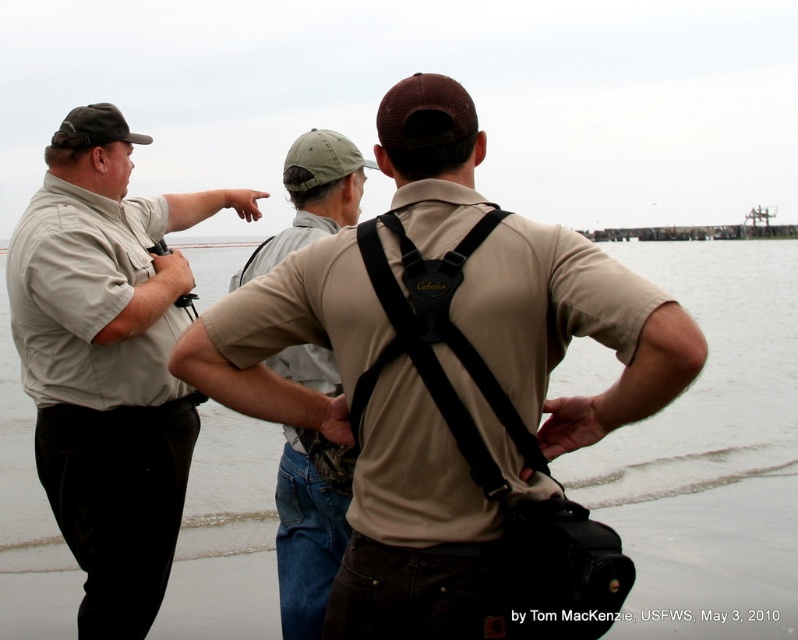
You are standing in the scene and want to locate the tan fabric shirt at center. According to the coordinates given, where should you look relative to the image frame?

The tan fabric shirt at center is located at coordinates point 0.609 on the x axis and 0.568 on the y axis within the image frame.

You are a photographer standing behind the two people at the shoreline. You want to take a photo of both the tan fabric shirt at center and the khaki cotton shirt at center. Which shirt should you focus on first to ensure it is in clear focus?

You should focus on the tan fabric shirt at center first because it is closer to the viewer than the khaki cotton shirt at center, so adjusting focus starting from the closer object ensures both will be in focus if they are in the same focal plane.

You are a photographer trying to capture a group photo of the matte khaki shirt at left and the khaki cotton shirt at center. Since you want them to appear the same height in the photo, what adjustment should you make to the camera angle or their positions?

Since the matte khaki shirt at left is much taller than the khaki cotton shirt at center, you can lower the camera angle slightly to make the taller person appear shorter or have the shorter person stand on a small platform to balance their heights in the photo.